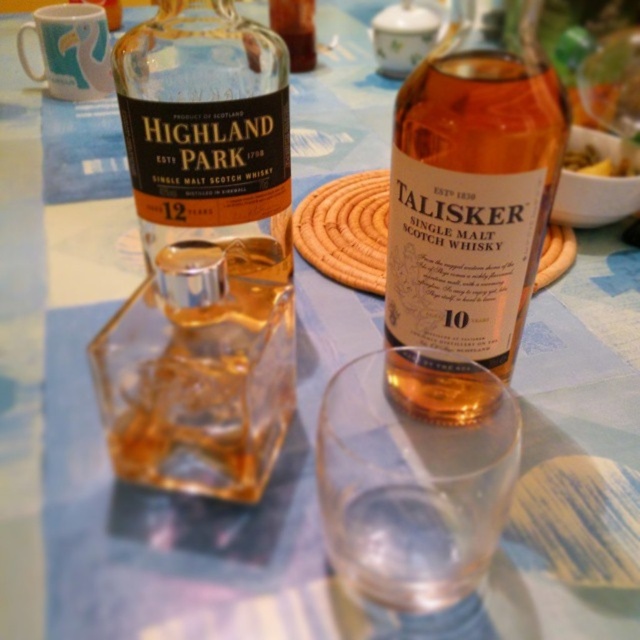
Is point (449, 396) positioned behind point (579, 157)?

No.

At what (x,y) coordinates should I click in order to perform the action: click on amber glass bottle at center. Please return your answer as a coordinate pair (x, y). Image resolution: width=640 pixels, height=640 pixels. Looking at the image, I should click on (472, 186).

Is matte glass bottle at center smaller than golden crispy fries at center?

Incorrect, matte glass bottle at center is not smaller in size than golden crispy fries at center.

Between point (280, 244) and point (602, 163), which one is positioned behind?

Positioned behind is point (602, 163).

The width and height of the screenshot is (640, 640). What are the coordinates of `matte glass bottle at center` in the screenshot? It's located at (202, 256).

Does matte glass bottle at center have a smaller size compared to amber glass bottle at center?

Incorrect, matte glass bottle at center is not smaller in size than amber glass bottle at center.

Which is in front, point (168, 288) or point (449, 337)?

Positioned in front is point (168, 288).

Which is behind, point (276, 349) or point (397, 202)?

The point (397, 202) is behind.

Where is `matte glass bottle at center`? matte glass bottle at center is located at coordinates (202, 256).